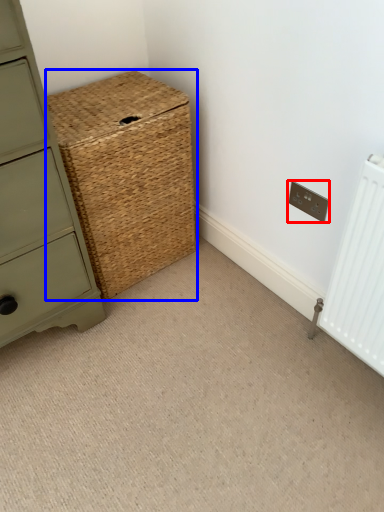
Question: Which object appears closest to the camera in this image, electric outlet (highlighted by a red box) or basket (highlighted by a blue box)?

Choices:
 (A) electric outlet
 (B) basket

Answer: (B)